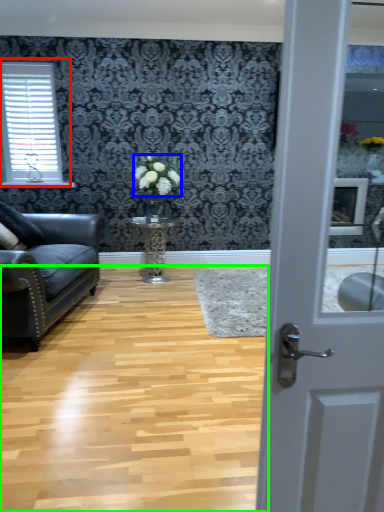
Question: Considering the real-world distances, which object is closest to window (highlighted by a red box)? flower (highlighted by a blue box) or plain (highlighted by a green box).

Choices:
 (A) flower
 (B) plain

Answer: (A)